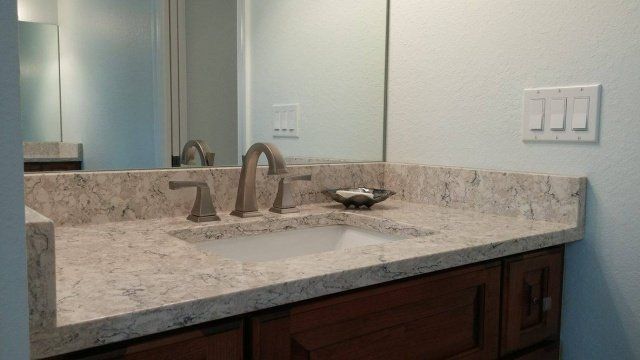
You are a GUI agent. You are given a task and a screenshot of the screen. Output one action in this format:
    pyautogui.click(x=<x>, y=<y>)
    Task: Click on the soap holder
    
    Given the screenshot: What is the action you would take?
    pyautogui.click(x=381, y=201)